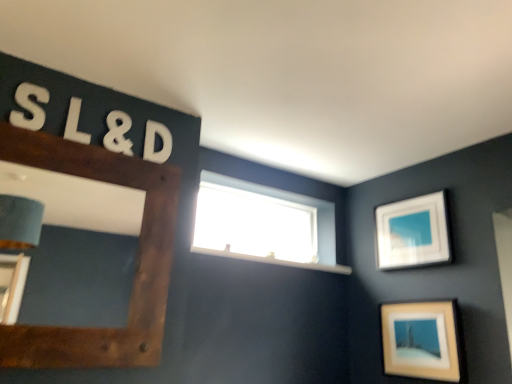
Question: Does white foam letter s at upper left, which is the first number in front-to-back order, have a greater width compared to transparent glass window at upper center?

Choices:
 (A) yes
 (B) no

Answer: (B)

Question: Can you confirm if white foam letter s at upper left, positioned as the 2th number in back-to-front order, is smaller than transparent glass window at upper center?

Choices:
 (A) yes
 (B) no

Answer: (A)

Question: Is white foam letter s at upper left, positioned as the 1th number in left-to-right order, surrounding transparent glass window at upper center?

Choices:
 (A) yes
 (B) no

Answer: (B)

Question: Is white foam letter s at upper left, which is the second number in right-to-left order, turned away from transparent glass window at upper center?

Choices:
 (A) yes
 (B) no

Answer: (B)

Question: Is white foam letter s at upper left, which is the first number in front-to-back order, placed right next to transparent glass window at upper center?

Choices:
 (A) no
 (B) yes

Answer: (A)

Question: From a real-world perspective, is white foam letter s at upper left, positioned as the 1th number in left-to-right order, over transparent glass window at upper center?

Choices:
 (A) yes
 (B) no

Answer: (A)

Question: Is white matte letter d at upper center, placed as the 1th letter when sorted from right to left, beside matte white picture frame at lower right, the second picture frame when ordered from right to left?

Choices:
 (A) yes
 (B) no

Answer: (B)

Question: From the image's perspective, is white matte letter d at upper center, which is the second letter from left to right, beneath matte white picture frame at lower right, the second picture frame when ordered from right to left?

Choices:
 (A) yes
 (B) no

Answer: (B)

Question: Would you say matte white picture frame at lower right, marked as the 2th picture frame in a back-to-front arrangement, is part of white matte letter d at upper center, which is the 2th letter from front to back,'s contents?

Choices:
 (A) yes
 (B) no

Answer: (B)

Question: Is white matte letter d at upper center, which is the first letter in back-to-front order, thinner than matte white picture frame at lower right, the second picture frame when ordered from right to left?

Choices:
 (A) yes
 (B) no

Answer: (A)

Question: Is white matte letter d at upper center, which is the first letter in back-to-front order, positioned with its back to matte white picture frame at lower right, the second picture frame when ordered from right to left?

Choices:
 (A) no
 (B) yes

Answer: (A)

Question: Does white matte letter d at upper center, which is the second letter from left to right, have a smaller size compared to matte white picture frame at lower right, placed as the 2th picture frame when sorted from left to right?

Choices:
 (A) no
 (B) yes

Answer: (B)

Question: Is matte white picture frame at lower right, marked as the 2th picture frame in a back-to-front arrangement, positioned behind white foam letter l at upper left, the 2th letter positioned from the back?

Choices:
 (A) no
 (B) yes

Answer: (B)